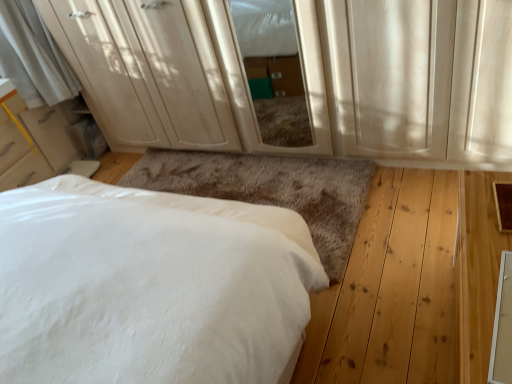
Question: Is matte white dresser at upper center positioned before matte wood screen door at center?

Choices:
 (A) yes
 (B) no

Answer: (B)

Question: Is matte white dresser at upper center with matte wood screen door at center?

Choices:
 (A) no
 (B) yes

Answer: (A)

Question: Can you confirm if matte white dresser at upper center is thinner than matte wood screen door at center?

Choices:
 (A) yes
 (B) no

Answer: (B)

Question: Is matte white dresser at upper center smaller than matte wood screen door at center?

Choices:
 (A) yes
 (B) no

Answer: (B)

Question: Does matte white dresser at upper center have a greater height compared to matte wood screen door at center?

Choices:
 (A) no
 (B) yes

Answer: (B)

Question: From the image's perspective, is matte white dresser at upper center under matte wood screen door at center?

Choices:
 (A) no
 (B) yes

Answer: (A)

Question: Is the position of white soft bed at lower left more distant than that of matte white dresser at upper center?

Choices:
 (A) no
 (B) yes

Answer: (A)

Question: Is white soft bed at lower left to the left of matte white dresser at upper center from the viewer's perspective?

Choices:
 (A) no
 (B) yes

Answer: (A)

Question: Considering the relative sizes of white soft bed at lower left and matte white dresser at upper center in the image provided, is white soft bed at lower left taller than matte white dresser at upper center?

Choices:
 (A) yes
 (B) no

Answer: (B)

Question: Is white soft bed at lower left with matte white dresser at upper center?

Choices:
 (A) yes
 (B) no

Answer: (B)

Question: Would you say matte white dresser at upper center is part of white soft bed at lower left's contents?

Choices:
 (A) yes
 (B) no

Answer: (B)

Question: From a real-world perspective, is white soft bed at lower left located higher than matte white dresser at upper center?

Choices:
 (A) no
 (B) yes

Answer: (A)

Question: Is matte wood screen door at center smaller than white soft bed at lower left?

Choices:
 (A) no
 (B) yes

Answer: (B)